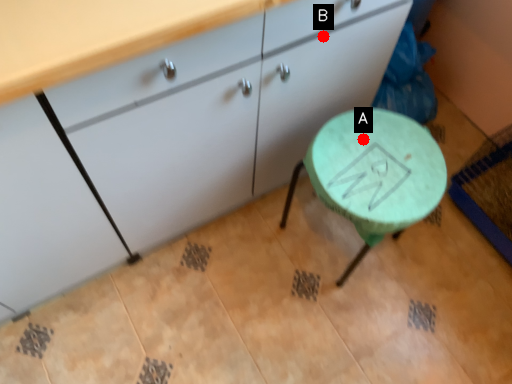
Question: Two points are circled on the image, labeled by A and B beside each circle. Which point is closer to the camera?

Choices:
 (A) A is closer
 (B) B is closer

Answer: (B)